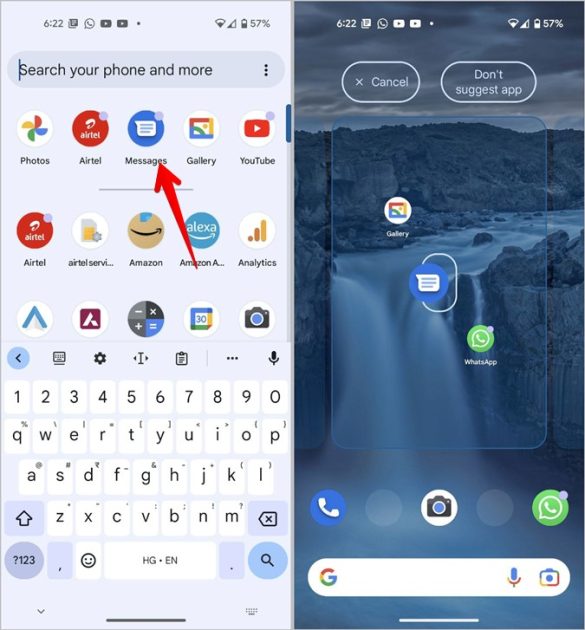
At what (x,y) coordinates should I click in order to perform the action: click on amazon alexa. Please return your answer as a coordinate pair (x, y). The image size is (585, 630). Looking at the image, I should click on tap(205, 241).